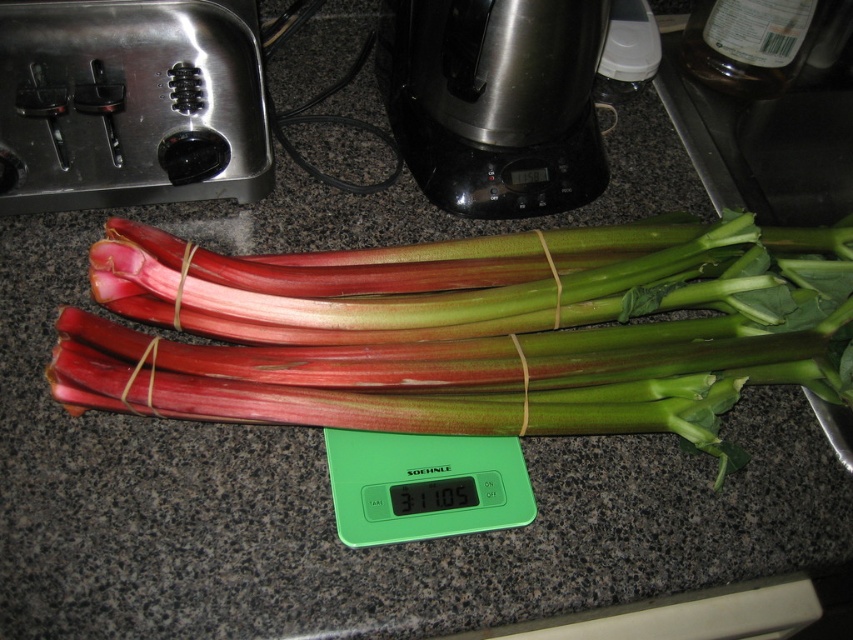
Question: Does pinkish-red fibrous rhubarb at center appear on the left side of green plastic scale at center?

Choices:
 (A) yes
 (B) no

Answer: (B)

Question: Which point is closer to the camera?

Choices:
 (A) stainless steel blender at center
 (B) pinkish-red fibrous rhubarb at center
 (C) green plastic scale at center

Answer: (B)

Question: Is stainless steel blender at center above green plastic scale at center?

Choices:
 (A) yes
 (B) no

Answer: (A)

Question: Is pinkish-red fibrous rhubarb at center thinner than green plastic scale at center?

Choices:
 (A) yes
 (B) no

Answer: (B)

Question: Which object is farther from the camera taking this photo?

Choices:
 (A) stainless steel blender at center
 (B) green plastic scale at center
 (C) pinkish-red fibrous rhubarb at center

Answer: (A)

Question: Which object appears farthest from the camera in this image?

Choices:
 (A) pinkish-red fibrous rhubarb at center
 (B) stainless steel blender at center

Answer: (B)